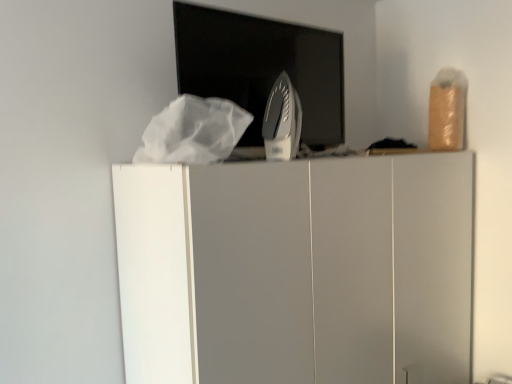
Question: From the image's perspective, is white matte cabinet at center located above silver metallic iron at center?

Choices:
 (A) no
 (B) yes

Answer: (A)

Question: Can you confirm if white matte cabinet at center is thinner than silver metallic iron at center?

Choices:
 (A) yes
 (B) no

Answer: (B)

Question: Is white matte cabinet at center to the left of silver metallic iron at center from the viewer's perspective?

Choices:
 (A) no
 (B) yes

Answer: (A)

Question: Would you consider white matte cabinet at center to be distant from silver metallic iron at center?

Choices:
 (A) no
 (B) yes

Answer: (A)

Question: Is white matte cabinet at center shorter than silver metallic iron at center?

Choices:
 (A) yes
 (B) no

Answer: (B)

Question: Is silver metallic iron at center inside the boundaries of metallic iron at center, or outside?

Choices:
 (A) outside
 (B) inside

Answer: (A)

Question: Is silver metallic iron at center to the left or to the right of metallic iron at center in the image?

Choices:
 (A) right
 (B) left

Answer: (A)

Question: Based on their sizes in the image, would you say silver metallic iron at center is bigger or smaller than metallic iron at center?

Choices:
 (A) small
 (B) big

Answer: (A)

Question: Considering their positions, is silver metallic iron at center located in front of or behind metallic iron at center?

Choices:
 (A) front
 (B) behind

Answer: (B)

Question: Considering the positions of point (143, 274) and point (225, 51), is point (143, 274) closer or farther from the camera than point (225, 51)?

Choices:
 (A) farther
 (B) closer

Answer: (B)

Question: Is white matte cabinet at center to the left or to the right of metallic iron at center in the image?

Choices:
 (A) left
 (B) right

Answer: (B)

Question: Looking at the image, does white matte cabinet at center seem bigger or smaller compared to metallic iron at center?

Choices:
 (A) big
 (B) small

Answer: (A)

Question: From their relative heights in the image, would you say white matte cabinet at center is taller or shorter than metallic iron at center?

Choices:
 (A) short
 (B) tall

Answer: (B)

Question: Considering the positions of metallic iron at center and white matte cabinet at center in the image, is metallic iron at center taller or shorter than white matte cabinet at center?

Choices:
 (A) tall
 (B) short

Answer: (B)

Question: Is metallic iron at center inside or outside of white matte cabinet at center?

Choices:
 (A) inside
 (B) outside

Answer: (B)